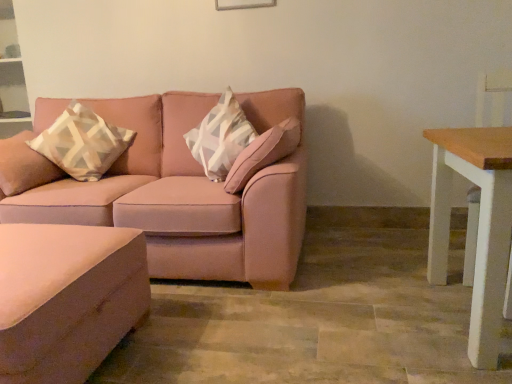
Question: Is point (86, 360) closer or farther from the camera than point (221, 268)?

Choices:
 (A) closer
 (B) farther

Answer: (A)

Question: In the image, is matte pink ottoman at lower left positioned in front of or behind matte pink couch at center?

Choices:
 (A) behind
 (B) front

Answer: (B)

Question: Which of these objects is positioned farthest from the matte pink couch at center?

Choices:
 (A) beige-patterned cushion at left
 (B) matte pink ottoman at lower left
 (C) wooden white table at right

Answer: (C)

Question: Estimate the real-world distances between objects in this image. Which object is closer to the beige-patterned cushion at left?

Choices:
 (A) wooden white table at right
 (B) matte pink ottoman at lower left
 (C) matte pink couch at center

Answer: (C)